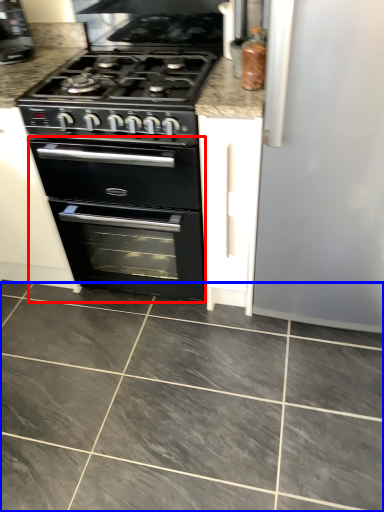
Question: Among these objects, which one is farthest to the camera, oven (highlighted by a red box) or ceramic tile (highlighted by a blue box)?

Choices:
 (A) oven
 (B) ceramic tile

Answer: (A)